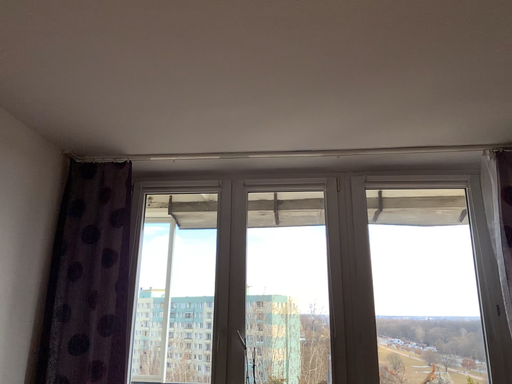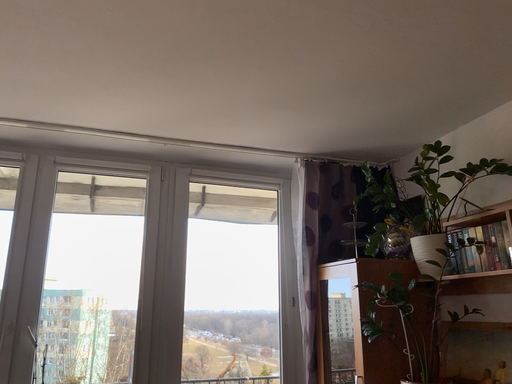
Question: Which way did the camera rotate in the video?

Choices:
 (A) rotated left
 (B) rotated right

Answer: (B)